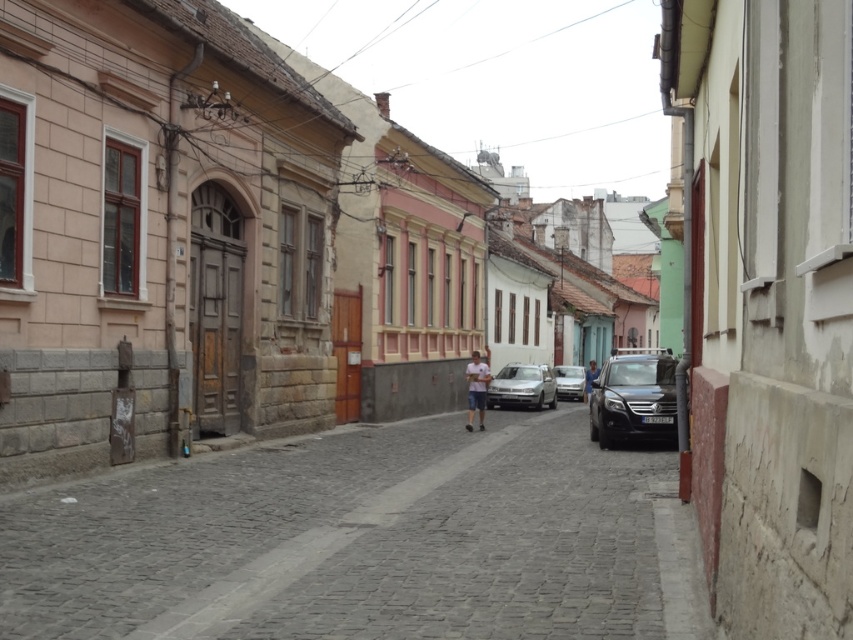
Question: Which object appears farthest from the camera in this image?

Choices:
 (A) silver metallic sedan at center
 (B) matte blue shirt at center
 (C) gray cobblestone street at center

Answer: (B)

Question: Does gray cobblestone street at center have a smaller size compared to matte blue shirt at center?

Choices:
 (A) no
 (B) yes

Answer: (A)

Question: Which object is positioned closest to the satin silver sedan at center?

Choices:
 (A) silver metallic sedan at center
 (B) shiny black suv at center
 (C) light blue denim shorts at center
 (D) gray cobblestone street at center

Answer: (B)

Question: Which point is farther to the camera?

Choices:
 (A) matte blue shirt at center
 (B) silver metallic sedan at center
 (C) gray cobblestone street at center
 (D) shiny black suv at center

Answer: (A)

Question: In this image, where is gray cobblestone street at center located relative to light blue denim shorts at center?

Choices:
 (A) above
 (B) below

Answer: (B)

Question: Does shiny black suv at center appear over light blue denim shorts at center?

Choices:
 (A) no
 (B) yes

Answer: (A)